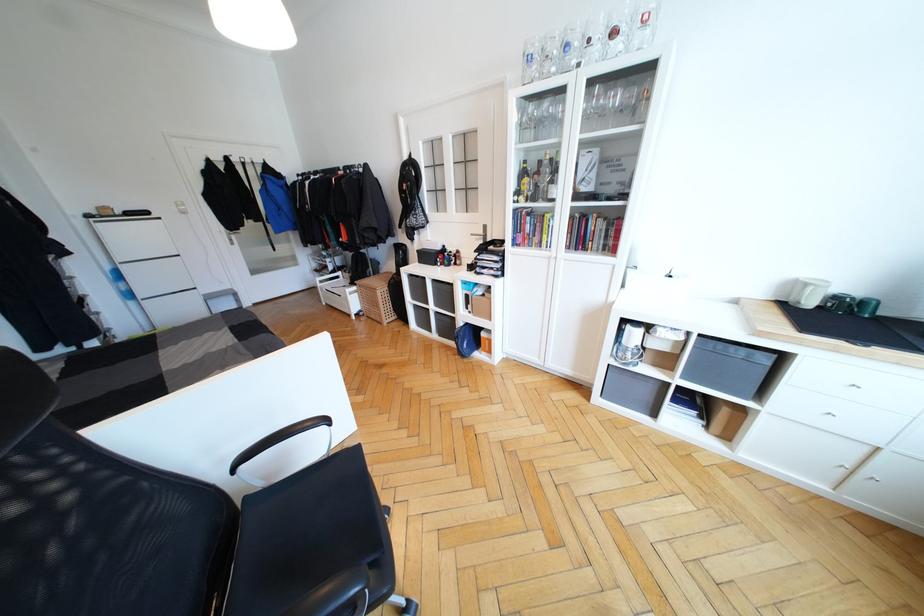
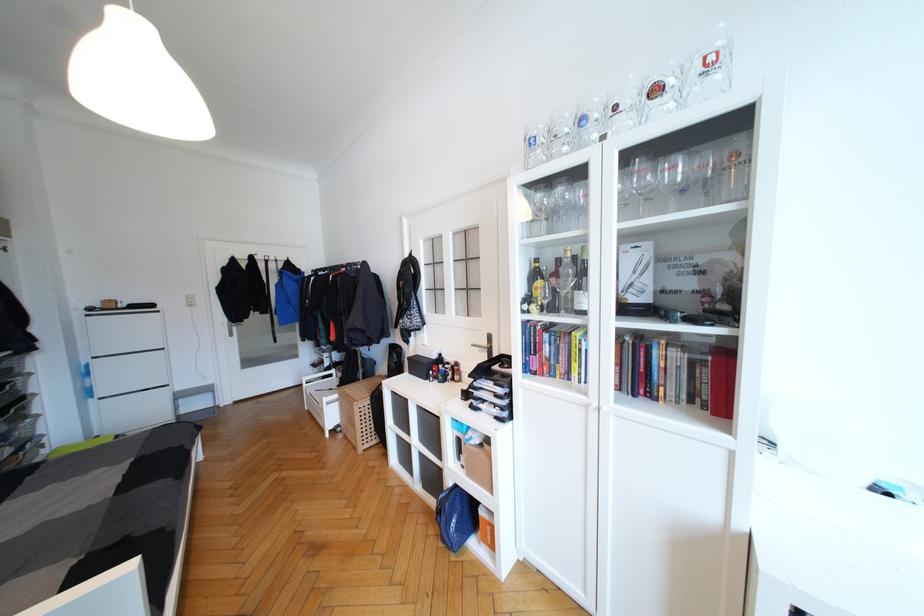
Where in the second image is the point corresponding to [197,299] from the first image?

(166, 397)